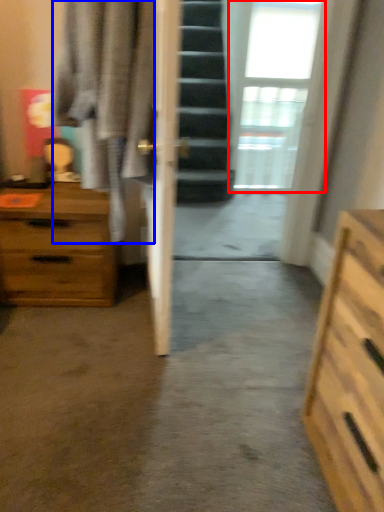
Question: Which object is closer to the camera taking this photo, window (highlighted by a red box) or robe (highlighted by a blue box)?

Choices:
 (A) window
 (B) robe

Answer: (B)